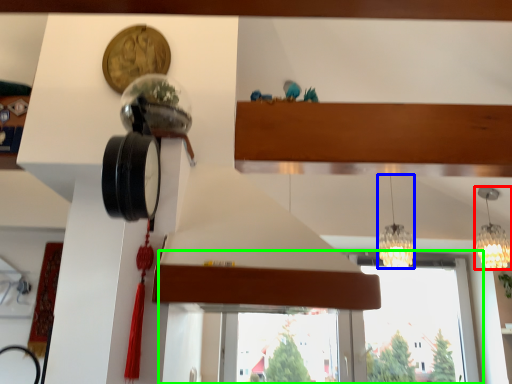
Question: Which object is positioned closest to lamp (highlighted by a red box)? Select from lamp (highlighted by a blue box) and window (highlighted by a green box).

Choices:
 (A) lamp
 (B) window

Answer: (A)